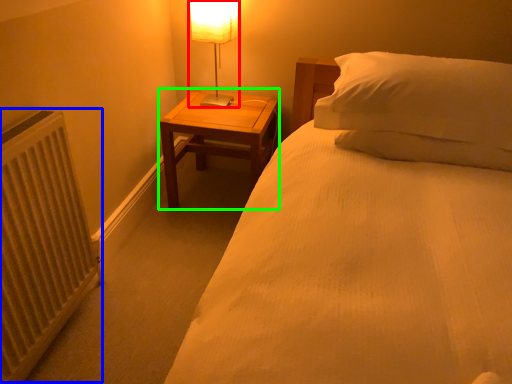
Question: Which is farther away from table lamp (highlighted by a red box)? radiator (highlighted by a blue box) or nightstand (highlighted by a green box)?

Choices:
 (A) radiator
 (B) nightstand

Answer: (A)